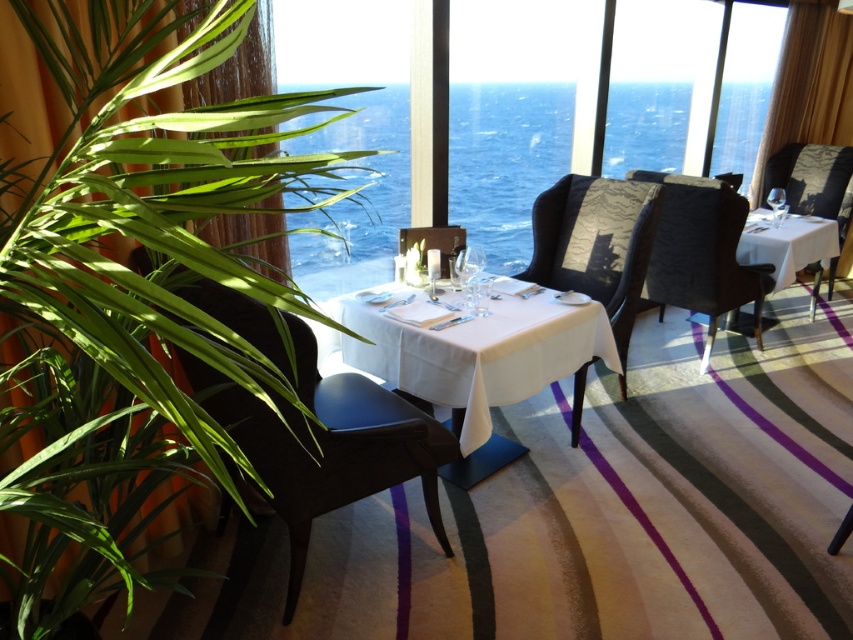
I want to click on transparent glass window at center, so click(x=450, y=116).

Is point (550, 156) more distant than point (469, 253)?

That is True.

This screenshot has width=853, height=640. I want to click on transparent glass window at center, so click(x=450, y=116).

Which is behind, point (383, 369) or point (439, 236)?

Positioned behind is point (439, 236).

Which of these two, white cloth at center or matte black chair at center, stands shorter?

matte black chair at center is shorter.

This screenshot has height=640, width=853. In order to click on white cloth at center in this screenshot , I will do click(x=473, y=353).

Which is in front, point (634, 268) or point (834, 170)?

Point (634, 268) is in front.

Is satin black chair at center wider than velvet dark brown chair at right?

Correct, the width of satin black chair at center exceeds that of velvet dark brown chair at right.

Between point (579, 224) and point (781, 163), which one is positioned behind?

The point (781, 163) is more distant.

I want to click on satin black chair at center, so click(x=596, y=244).